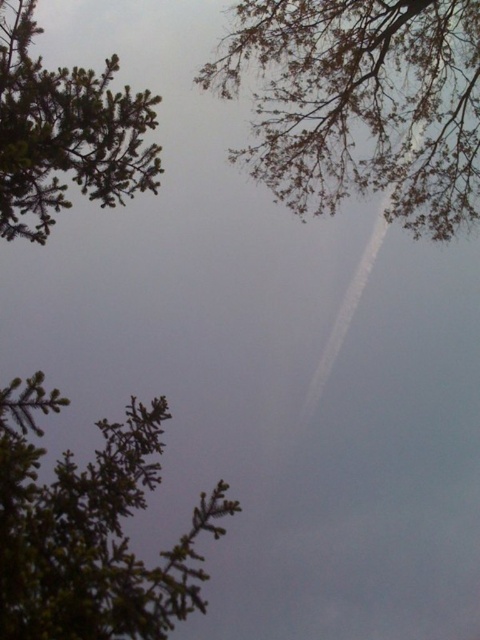
You are standing in a forest clearing and see a point at coordinates point (408,156). A bird is flying towards this point. If the bird flies at a constant speed of 15 feet per second, how many seconds will it take for the bird to reach the point?

The bird will take approximately 3 seconds to reach the point (408,156) since the distance is 45.22 feet and the speed is 15 feet per second.

You are standing in a forest clearing and looking up at the sky between two green matte trees. Which tree, the green matte tree at lower left or the green matte tree at upper left, appears taller in the view?

The green matte tree at upper left appears taller than the green matte tree at lower left in the view.

You are standing in a forest clearing and looking up at the sky through the trees. You notice a point in the sky at coordinates point (344, 148). If you want to reach that point with a 12 meter long pole, will the pole be long enough?

The point (344, 148) is 13.09 meters away from the viewer. Since the pole is only 12 meters long, it will not be long enough to reach the point.